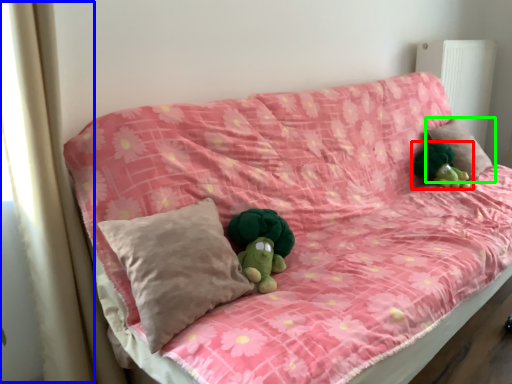
Question: Considering the real-world distances, which object is farthest from toy (highlighted by a red box)? curtain (highlighted by a blue box) or pillow (highlighted by a green box)?

Choices:
 (A) curtain
 (B) pillow

Answer: (A)